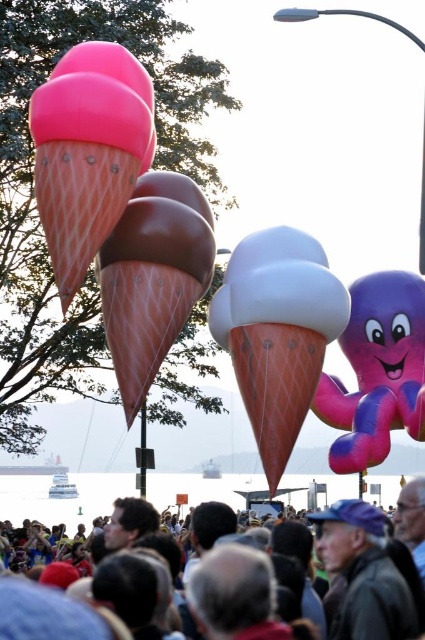
Question: Which object appears farthest from the camera in this image?

Choices:
 (A) white matte ice cream cone at center
 (B) matte pink ice cream cone at center

Answer: (B)

Question: Which point is closer to the camera taking this photo?

Choices:
 (A) (113, 92)
 (B) (186, 314)
 (C) (297, 260)
 (D) (397, 333)

Answer: (A)

Question: Is pink matte ice cream cone at upper left further to camera compared to dark gray fabric crowd at lower center?

Choices:
 (A) yes
 (B) no

Answer: (A)

Question: Does white matte ice cream cone at center have a larger size compared to matte pink ice cream cone at center?

Choices:
 (A) no
 (B) yes

Answer: (B)

Question: Can you confirm if purple glossy octopus at right is positioned to the right of dark gray fabric crowd at lower center?

Choices:
 (A) no
 (B) yes

Answer: (B)

Question: Which object is the closest to the white matte ice cream cone at center?

Choices:
 (A) pink matte ice cream cone at upper left
 (B) dark gray fabric crowd at lower center
 (C) pink rubber ice cream cone at left

Answer: (A)